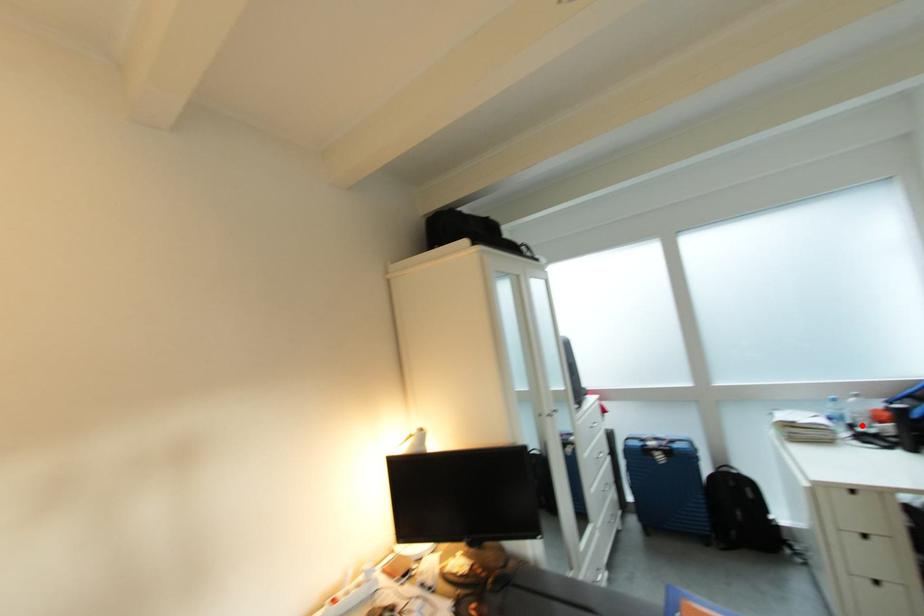
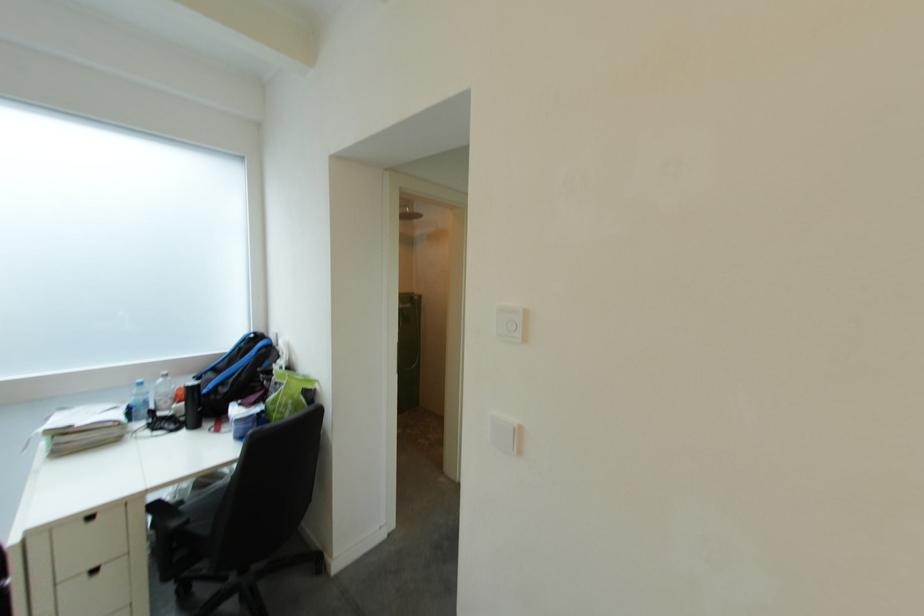
In the second image, find the point that corresponds to the highlighted location in the first image.

(163, 410)